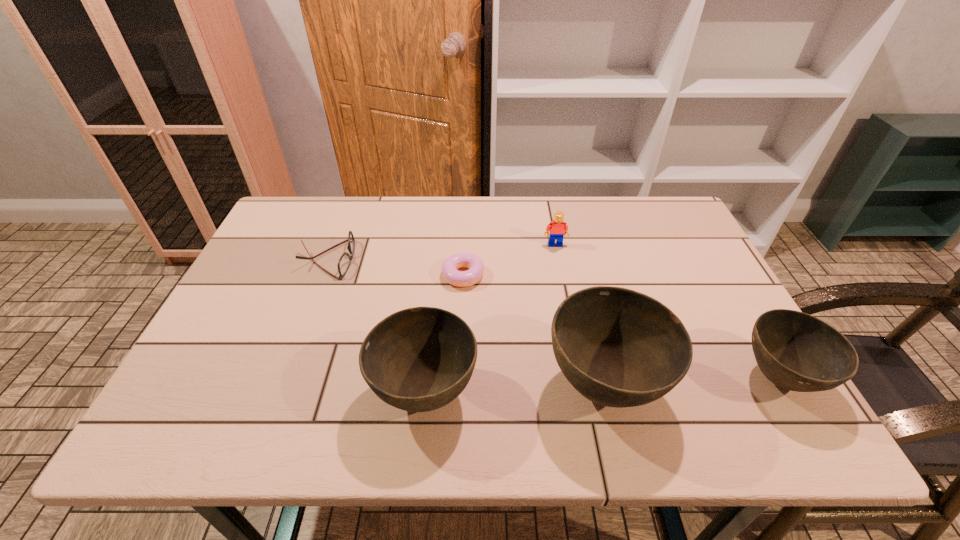
This screenshot has height=540, width=960. Identify the location of the leftmost bowl. click(x=419, y=359).

The height and width of the screenshot is (540, 960). What are the coordinates of `the second shortest bowl` in the screenshot? It's located at (419, 359).

In order to click on the second bowl from right to left in this screenshot , I will do `click(619, 348)`.

This screenshot has height=540, width=960. Identify the location of the shortest bowl. (796, 351).

This screenshot has width=960, height=540. Identify the location of the rightmost object. (796, 351).

Locate an element on the screen. The height and width of the screenshot is (540, 960). spectacles is located at coordinates (x=344, y=262).

Where is `doughnut`? The height and width of the screenshot is (540, 960). doughnut is located at coordinates (449, 268).

The width and height of the screenshot is (960, 540). Find the location of `Lego`. Lego is located at coordinates (558, 229).

This screenshot has height=540, width=960. In order to click on vacant region located 0.250m on the left of the fifth shortest object in this screenshot , I will do `click(254, 393)`.

This screenshot has height=540, width=960. In order to click on free space located 0.340m on the back of the second bowl from left to right in this screenshot , I will do `click(571, 248)`.